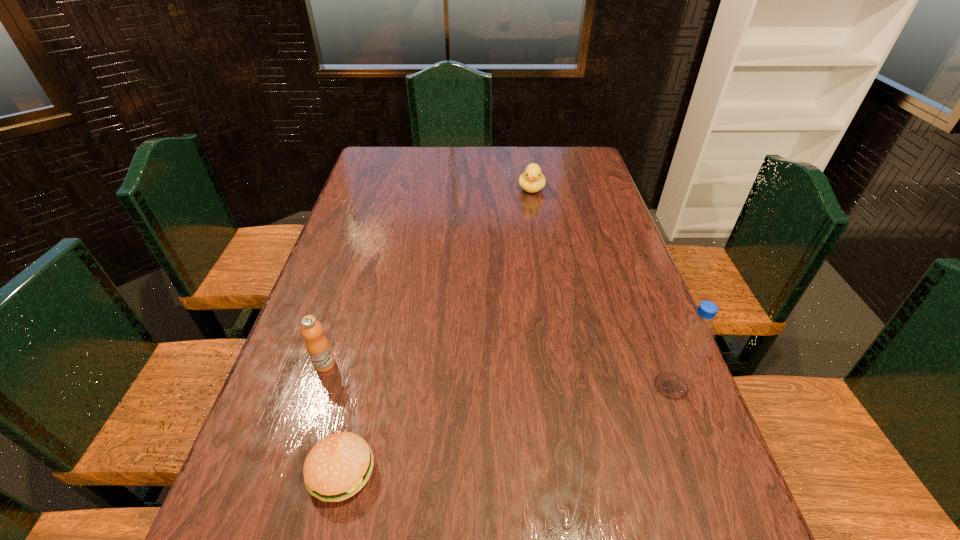
This screenshot has height=540, width=960. Find the location of `free space on the desktop that is between the nearest object and the water bottle and is positioned on the beak of the second shortest object`. free space on the desktop that is between the nearest object and the water bottle and is positioned on the beak of the second shortest object is located at coordinates (526, 423).

I want to click on vacant spot on the desktop that is between the shortest object and the tallest object and is positioned on the front label of the second farthest object, so click(x=517, y=426).